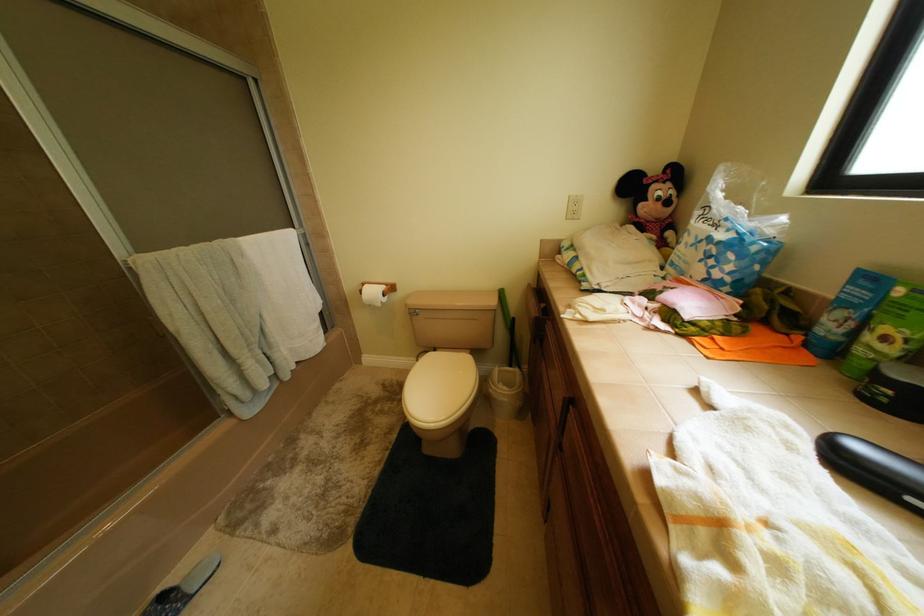
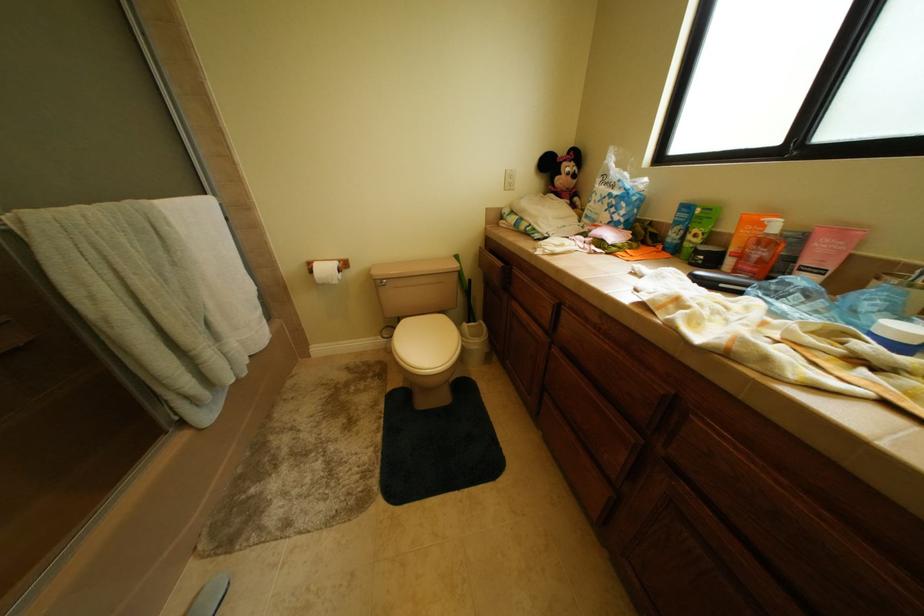
Question: The first image is from the beginning of the video and the second image is from the end. How did the camera likely rotate when shooting the video?

Choices:
 (A) Left
 (B) Right
 (C) Up
 (D) Down

Answer: (B)